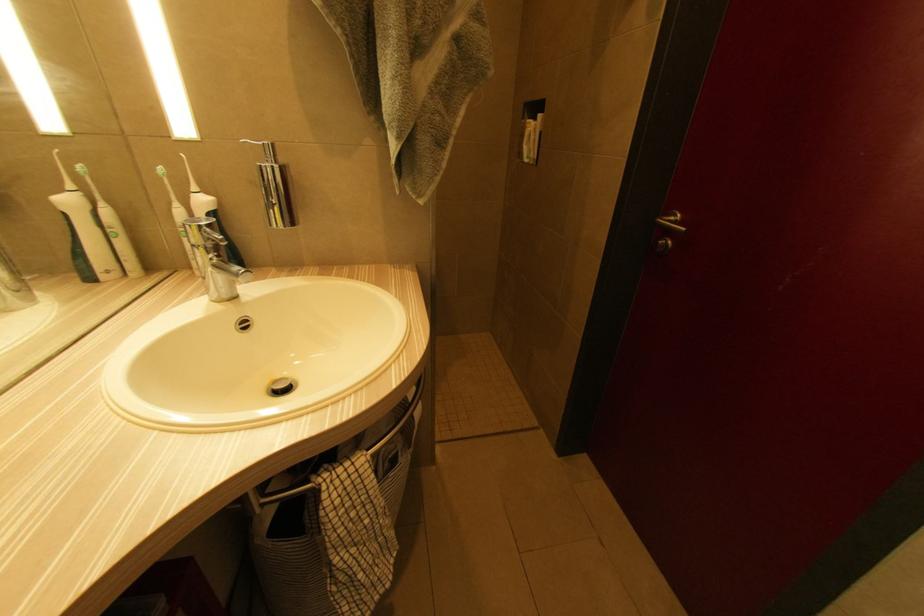
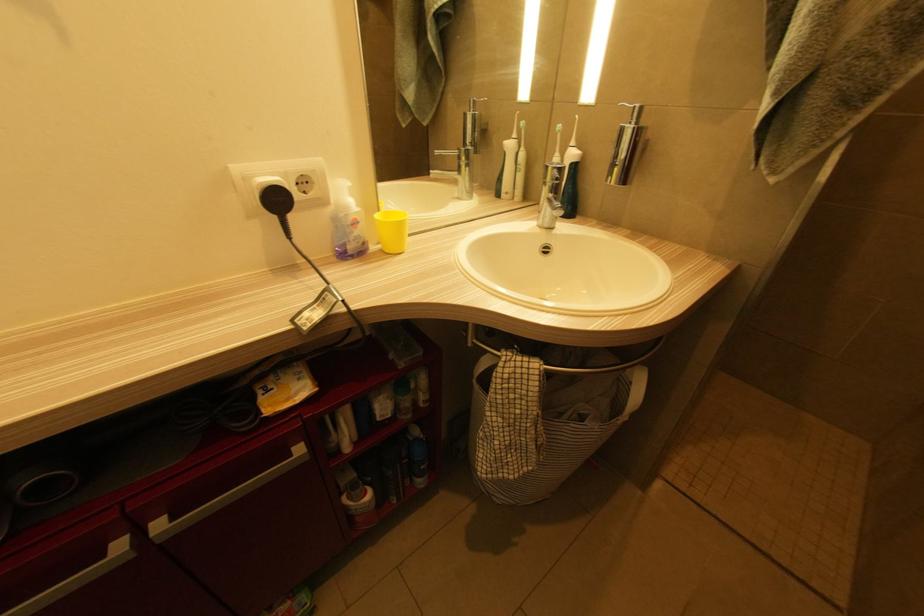
Question: Based on the continuous images, in which direction is the camera rotating? Reply with the corresponding letter.

Choices:
 (A) Left
 (B) Right
 (C) Up
 (D) Down

Answer: (A)